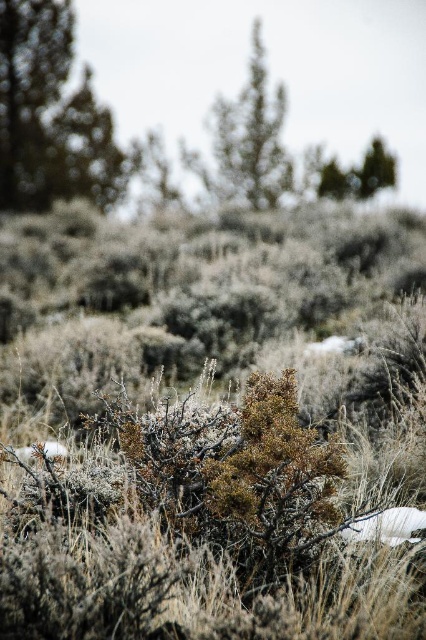
Question: Which point appears farthest from the camera in this image?

Choices:
 (A) (264, 168)
 (B) (71, 100)

Answer: (B)

Question: Is green textured tree at upper left wider than green textured tree at upper center?

Choices:
 (A) yes
 (B) no

Answer: (B)

Question: Which object appears closest to the camera in this image?

Choices:
 (A) green textured tree at upper left
 (B) green textured tree at upper center

Answer: (A)

Question: Can you confirm if green textured tree at upper left is positioned above green textured tree at upper center?

Choices:
 (A) yes
 (B) no

Answer: (A)

Question: Is the position of green textured tree at upper left more distant than that of green textured tree at upper center?

Choices:
 (A) yes
 (B) no

Answer: (B)

Question: Which of the following is the farthest from the observer?

Choices:
 (A) green textured tree at upper left
 (B) green textured tree at upper center

Answer: (B)